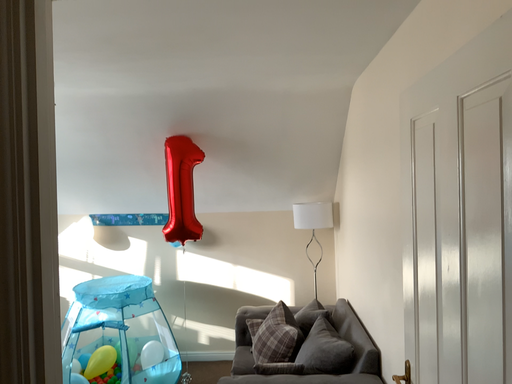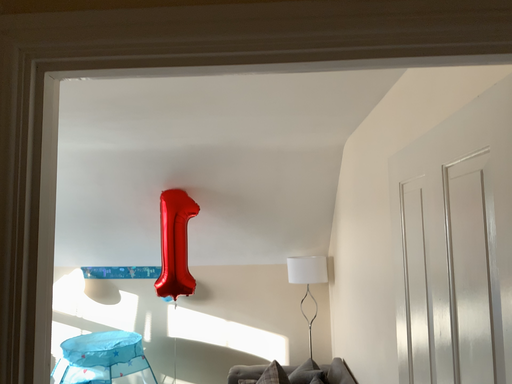
Question: Which way did the camera rotate in the video?

Choices:
 (A) rotated downward
 (B) rotated upward

Answer: (B)